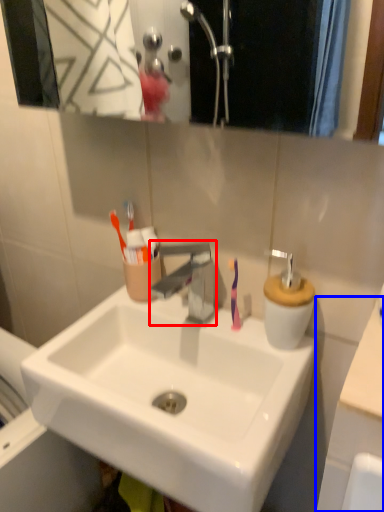
Question: Which point is closer to the camera, tap (highlighted by a red box) or counter top (highlighted by a blue box)?

Choices:
 (A) tap
 (B) counter top

Answer: (B)